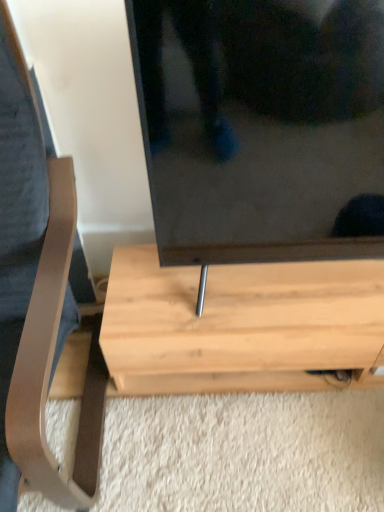
The height and width of the screenshot is (512, 384). In order to click on light brown wood coffee table at left in this screenshot , I will do `click(39, 292)`.

The height and width of the screenshot is (512, 384). What do you see at coordinates (39, 292) in the screenshot?
I see `light brown wood coffee table at left` at bounding box center [39, 292].

Describe the element at coordinates (241, 325) in the screenshot. I see `light wood table at center` at that location.

I want to click on light wood table at center, so click(241, 325).

The image size is (384, 512). I want to click on light brown wood coffee table at left, so click(x=39, y=292).

Based on the photo, which object is positioned more to the right, light wood table at center or light brown wood coffee table at left?

light wood table at center is more to the right.

Which object is more forward, light wood table at center or light brown wood coffee table at left?

Answer: light brown wood coffee table at left is more forward.

Between point (192, 317) and point (10, 275), which one is positioned behind?

The point (192, 317) is farther.

From the image's perspective, which one is positioned higher, light wood table at center or light brown wood coffee table at left?

light brown wood coffee table at left, from the image's perspective.

From the picture: From a real-world perspective, is light wood table at center located beneath light brown wood coffee table at left?

Yes.

Can you confirm if light wood table at center is wider than light brown wood coffee table at left?

No, light wood table at center is not wider than light brown wood coffee table at left.

Who is taller, light wood table at center or light brown wood coffee table at left?

light brown wood coffee table at left.

Considering the sizes of objects light wood table at center and light brown wood coffee table at left in the image provided, who is smaller, light wood table at center or light brown wood coffee table at left?

With smaller size is light wood table at center.

Is light wood table at center located outside light brown wood coffee table at left?

Yes, light wood table at center is not within light brown wood coffee table at left.

Is light wood table at center not close to light brown wood coffee table at left?

No, light wood table at center is not far from light brown wood coffee table at left.

Does light wood table at center turn towards light brown wood coffee table at left?

No, light wood table at center is not aimed at light brown wood coffee table at left.

How different are the orientations of light wood table at center and light brown wood coffee table at left in degrees?

The angular difference between light wood table at center and light brown wood coffee table at left is 0.305 degrees.

Where is `furniture that appears above the light wood table at center (from the image's perspective)`? This screenshot has width=384, height=512. furniture that appears above the light wood table at center (from the image's perspective) is located at coordinates (39, 292).

Between light brown wood coffee table at left and light wood table at center, which one appears on the right side from the viewer's perspective?

light wood table at center.

Which object is further away from the camera, light brown wood coffee table at left or light wood table at center?

light wood table at center is further away from the camera.

Is point (58, 217) closer or farther from the camera than point (360, 293)?

Point (58, 217) is closer to the camera than point (360, 293).

From the image's perspective, which one is positioned higher, light brown wood coffee table at left or light wood table at center?

light brown wood coffee table at left.

From a real-world perspective, who is located higher, light brown wood coffee table at left or light wood table at center?

light brown wood coffee table at left, from a real-world perspective.

Considering the sizes of objects light brown wood coffee table at left and light wood table at center in the image provided, who is thinner, light brown wood coffee table at left or light wood table at center?

light wood table at center.

Who is shorter, light brown wood coffee table at left or light wood table at center?

Standing shorter between the two is light wood table at center.

Considering the relative sizes of light brown wood coffee table at left and light wood table at center in the image provided, is light brown wood coffee table at left smaller than light wood table at center?

Actually, light brown wood coffee table at left might be larger than light wood table at center.

Do you think light brown wood coffee table at left is within light wood table at center, or outside of it?

light brown wood coffee table at left is not inside light wood table at center, it's outside.

Is light brown wood coffee table at left directly adjacent to light wood table at center?

light brown wood coffee table at left is not next to light wood table at center, and they're not touching.

Could you tell me if light brown wood coffee table at left is turned towards light wood table at center?

No, light brown wood coffee table at left does not turn towards light wood table at center.

Find the location of `table below the light brown wood coffee table at left (from a real-world perspective)`. table below the light brown wood coffee table at left (from a real-world perspective) is located at coordinates (241, 325).

Where is `table below the light brown wood coffee table at left (from the image's perspective)`? table below the light brown wood coffee table at left (from the image's perspective) is located at coordinates (241, 325).

Locate an element on the screen. furniture lying above the light wood table at center (from the image's perspective) is located at coordinates (39, 292).